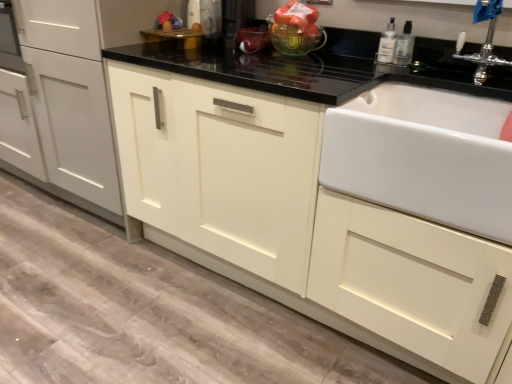
What do you see at coordinates (387, 44) in the screenshot? This screenshot has height=384, width=512. I see `clear plastic bottle at upper right, positioned as the 1th bottle in left-to-right order` at bounding box center [387, 44].

What do you see at coordinates (485, 40) in the screenshot? This screenshot has width=512, height=384. I see `silver metallic faucet at upper right` at bounding box center [485, 40].

Image resolution: width=512 pixels, height=384 pixels. What do you see at coordinates (298, 222) in the screenshot?
I see `matte white cabinet at center, which appears as the 1th cabinetry when viewed from the right` at bounding box center [298, 222].

This screenshot has height=384, width=512. Find the location of `matte white cabinet at center, the second cabinetry when ordered from left to right`. matte white cabinet at center, the second cabinetry when ordered from left to right is located at coordinates (298, 222).

This screenshot has width=512, height=384. What do you see at coordinates (424, 156) in the screenshot?
I see `white ceramic sink at right` at bounding box center [424, 156].

In order to face translucent glass bowl at upper center, should I rotate leftwards or rightwards?

Turn right by 4.719 degrees to look at translucent glass bowl at upper center.

Identify the location of translucent glass bowl at upper center. (298, 17).

This screenshot has width=512, height=384. Find the location of `clear plastic bottle at upper right, positioned as the 1th bottle in left-to-right order`. clear plastic bottle at upper right, positioned as the 1th bottle in left-to-right order is located at coordinates 387,44.

Based on the photo, would you say matte white cabinet at center, which appears as the 1th cabinetry when viewed from the right, is a long distance from clear plastic bottle at upper right, which is the second bottle from left to right?

matte white cabinet at center, which appears as the 1th cabinetry when viewed from the right, is near clear plastic bottle at upper right, which is the second bottle from left to right, not far away.

Looking at this image, between matte white cabinet at center, the second cabinetry when ordered from left to right, and clear plastic bottle at upper right, which is the second bottle from left to right, which one has smaller size?

Smaller between the two is clear plastic bottle at upper right, which is the second bottle from left to right.

In the scene shown: From a real-world perspective, does matte white cabinet at center, which appears as the 1th cabinetry when viewed from the right, sit lower than clear plastic bottle at upper right, the 1th bottle positioned from the right?

Correct, in the physical world, matte white cabinet at center, which appears as the 1th cabinetry when viewed from the right, is lower than clear plastic bottle at upper right, the 1th bottle positioned from the right.

Is matte white cabinet at center, the second cabinetry when ordered from left to right, in front of or behind clear plastic bottle at upper right, the 1th bottle positioned from the right, in the image?

matte white cabinet at center, the second cabinetry when ordered from left to right, is positioned closer to the viewer than clear plastic bottle at upper right, the 1th bottle positioned from the right.

Which object is closer to the camera, matte white cabinet at center, which ranks as the 1th cabinetry in left-to-right order, or matte white cabinet at center, which appears as the 1th cabinetry when viewed from the right?

matte white cabinet at center, which appears as the 1th cabinetry when viewed from the right.

What's the angular difference between matte white cabinet at center, which ranks as the 1th cabinetry in left-to-right order, and matte white cabinet at center, which appears as the 1th cabinetry when viewed from the right,'s facing directions?

The angle between the facing direction of matte white cabinet at center, which ranks as the 1th cabinetry in left-to-right order, and the facing direction of matte white cabinet at center, which appears as the 1th cabinetry when viewed from the right, is 0.389 degrees.

Could you tell me if matte white cabinet at center, which ranks as the 2th cabinetry in right-to-left order, is facing matte white cabinet at center, the second cabinetry when ordered from left to right?

No, matte white cabinet at center, which ranks as the 2th cabinetry in right-to-left order, does not turn towards matte white cabinet at center, the second cabinetry when ordered from left to right.

Is matte white cabinet at center, which ranks as the 1th cabinetry in left-to-right order, wider or thinner than matte white cabinet at center, which appears as the 1th cabinetry when viewed from the right?

Clearly, matte white cabinet at center, which ranks as the 1th cabinetry in left-to-right order, has more width compared to matte white cabinet at center, which appears as the 1th cabinetry when viewed from the right.

From the image's perspective, relative to clear plastic bottle at upper right, positioned as the 1th bottle in left-to-right order, is matte white cabinet at center, the second cabinetry when ordered from left to right, above or below?

matte white cabinet at center, the second cabinetry when ordered from left to right, is below clear plastic bottle at upper right, positioned as the 1th bottle in left-to-right order.

Find the location of a particular element. The image size is (512, 384). the 1st cabinetry counting from the left of the clear plastic bottle at upper right, positioned as the 1th bottle in left-to-right order is located at coordinates (298, 222).

Which is in front, matte white cabinet at center, the second cabinetry when ordered from left to right, or clear plastic bottle at upper right, positioned as the 1th bottle in left-to-right order?

matte white cabinet at center, the second cabinetry when ordered from left to right.

Can you tell me how much matte white cabinet at center, the second cabinetry when ordered from left to right, and clear plastic bottle at upper right, the second bottle when ordered from right to left, differ in facing direction?

There is a 0.458-degree angle between the facing directions of matte white cabinet at center, the second cabinetry when ordered from left to right, and clear plastic bottle at upper right, the second bottle when ordered from right to left.

From a real-world perspective, who is located higher, translucent glass bowl at upper center or silver metallic faucet at upper right?

In real-world perspective, translucent glass bowl at upper center is above.

Between translucent glass bowl at upper center and silver metallic faucet at upper right, which one appears on the left side from the viewer's perspective?

From the viewer's perspective, translucent glass bowl at upper center appears more on the left side.

Between translucent glass bowl at upper center and silver metallic faucet at upper right, which one has smaller width?

translucent glass bowl at upper center.

What are the coordinates of `fruit above the silver metallic faucet at upper right (from a real-world perspective)` in the screenshot? It's located at (298, 17).

From a real-world perspective, is clear plastic bottle at upper right, the 1th bottle positioned from the right, positioned above or below white ceramic sink at right?

In terms of real-world spatial position, clear plastic bottle at upper right, the 1th bottle positioned from the right, is above white ceramic sink at right.

Is clear plastic bottle at upper right, the 1th bottle positioned from the right, smaller than white ceramic sink at right?

Indeed, clear plastic bottle at upper right, the 1th bottle positioned from the right, has a smaller size compared to white ceramic sink at right.

Is there a large distance between clear plastic bottle at upper right, which is the second bottle from left to right, and white ceramic sink at right?

No, clear plastic bottle at upper right, which is the second bottle from left to right, is not far away from white ceramic sink at right.

Is matte white cabinet at center, the second cabinetry when ordered from left to right, oriented away from silver metallic faucet at upper right?

No, silver metallic faucet at upper right is not at the back of matte white cabinet at center, the second cabinetry when ordered from left to right.

Considering the relative positions of matte white cabinet at center, which appears as the 1th cabinetry when viewed from the right, and silver metallic faucet at upper right in the image provided, is matte white cabinet at center, which appears as the 1th cabinetry when viewed from the right, to the left of silver metallic faucet at upper right from the viewer's perspective?

Indeed, matte white cabinet at center, which appears as the 1th cabinetry when viewed from the right, is positioned on the left side of silver metallic faucet at upper right.

Is matte white cabinet at center, the second cabinetry when ordered from left to right, situated inside silver metallic faucet at upper right or outside?

matte white cabinet at center, the second cabinetry when ordered from left to right, lies outside silver metallic faucet at upper right.

Locate an element on the screen. Image resolution: width=512 pixels, height=384 pixels. cabinetry located below the silver metallic faucet at upper right (from the image's perspective) is located at coordinates (298, 222).

Consider the image. Considering the sizes of objects matte white cabinet at center, which ranks as the 1th cabinetry in left-to-right order, and clear plastic bottle at upper right, the second bottle when ordered from right to left, in the image provided, who is thinner, matte white cabinet at center, which ranks as the 1th cabinetry in left-to-right order, or clear plastic bottle at upper right, the second bottle when ordered from right to left,?

clear plastic bottle at upper right, the second bottle when ordered from right to left, is thinner.

Considering the sizes of matte white cabinet at center, which ranks as the 1th cabinetry in left-to-right order, and clear plastic bottle at upper right, the second bottle when ordered from right to left, in the image, is matte white cabinet at center, which ranks as the 1th cabinetry in left-to-right order, bigger or smaller than clear plastic bottle at upper right, the second bottle when ordered from right to left,?

matte white cabinet at center, which ranks as the 1th cabinetry in left-to-right order, is bigger than clear plastic bottle at upper right, the second bottle when ordered from right to left.

Could you tell me if matte white cabinet at center, which ranks as the 2th cabinetry in right-to-left order, is turned towards clear plastic bottle at upper right, the second bottle when ordered from right to left?

No, matte white cabinet at center, which ranks as the 2th cabinetry in right-to-left order, is not facing towards clear plastic bottle at upper right, the second bottle when ordered from right to left.

How different are the orientations of matte white cabinet at center, which ranks as the 2th cabinetry in right-to-left order, and clear plastic bottle at upper right, positioned as the 1th bottle in left-to-right order, in degrees?

0.0695 degrees.

At what (x,y) coordinates should I click in order to perform the action: click on the 2nd bottle to the right of the matte white cabinet at center, the second cabinetry when ordered from left to right, counting from the anchor's position. Please return your answer as a coordinate pair (x, y). This screenshot has width=512, height=384. Looking at the image, I should click on (404, 46).

This screenshot has height=384, width=512. Identify the location of cabinetry below the matte white cabinet at center, which ranks as the 2th cabinetry in right-to-left order (from the image's perspective). (298, 222).

Which object lies nearer to the anchor point matte white cabinet at center, which ranks as the 2th cabinetry in right-to-left order, silver metallic faucet at upper right or translucent glass bowl at upper center?

translucent glass bowl at upper center is closer to matte white cabinet at center, which ranks as the 2th cabinetry in right-to-left order.

When comparing their distances from matte white cabinet at center, which ranks as the 1th cabinetry in left-to-right order, does matte white cabinet at center, which appears as the 1th cabinetry when viewed from the right, or white ceramic sink at right seem further?

white ceramic sink at right is further to matte white cabinet at center, which ranks as the 1th cabinetry in left-to-right order.

Looking at the image, which one is located further to clear plastic bottle at upper right, the 1th bottle positioned from the right, silver metallic faucet at upper right or matte white cabinet at center, which ranks as the 2th cabinetry in right-to-left order?

Among the two, matte white cabinet at center, which ranks as the 2th cabinetry in right-to-left order, is located further to clear plastic bottle at upper right, the 1th bottle positioned from the right.

When comparing their distances from clear plastic bottle at upper right, positioned as the 1th bottle in left-to-right order, does white ceramic sink at right or silver metallic faucet at upper right seem further?

Among the two, white ceramic sink at right is located further to clear plastic bottle at upper right, positioned as the 1th bottle in left-to-right order.

Based on their spatial positions, is clear plastic bottle at upper right, positioned as the 1th bottle in left-to-right order, or matte white cabinet at center, the second cabinetry when ordered from left to right, closer to silver metallic faucet at upper right?

Based on the image, clear plastic bottle at upper right, positioned as the 1th bottle in left-to-right order, appears to be nearer to silver metallic faucet at upper right.

Looking at the image, which one is located closer to clear plastic bottle at upper right, positioned as the 1th bottle in left-to-right order, matte white cabinet at center, which appears as the 1th cabinetry when viewed from the right, or white ceramic sink at right?

white ceramic sink at right is closer to clear plastic bottle at upper right, positioned as the 1th bottle in left-to-right order.

When comparing their distances from silver metallic faucet at upper right, does matte white cabinet at center, the second cabinetry when ordered from left to right, or white ceramic sink at right seem closer?

white ceramic sink at right.

When comparing their distances from matte white cabinet at center, which ranks as the 1th cabinetry in left-to-right order, does clear plastic bottle at upper right, which is the second bottle from left to right, or translucent glass bowl at upper center seem further?

clear plastic bottle at upper right, which is the second bottle from left to right.

Identify the location of sink located between matte white cabinet at center, which appears as the 1th cabinetry when viewed from the right, and clear plastic bottle at upper right, positioned as the 1th bottle in left-to-right order, in the depth direction. (424, 156).

The image size is (512, 384). In order to click on fruit between matte white cabinet at center, which ranks as the 2th cabinetry in right-to-left order, and white ceramic sink at right from left to right in this screenshot , I will do `click(298, 17)`.

The height and width of the screenshot is (384, 512). Identify the location of bottle between translucent glass bowl at upper center and clear plastic bottle at upper right, which is the second bottle from left to right. (387, 44).

Image resolution: width=512 pixels, height=384 pixels. What are the coordinates of `fruit between matte white cabinet at center, which ranks as the 1th cabinetry in left-to-right order, and silver metallic faucet at upper right, in the horizontal direction` in the screenshot? It's located at (298, 17).